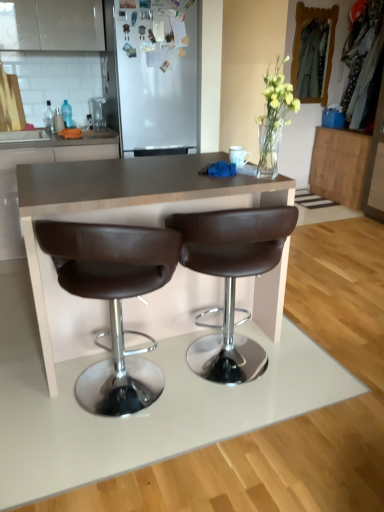
Where is `unoccupied area in front of brown leather table at center`? unoccupied area in front of brown leather table at center is located at coordinates (173, 451).